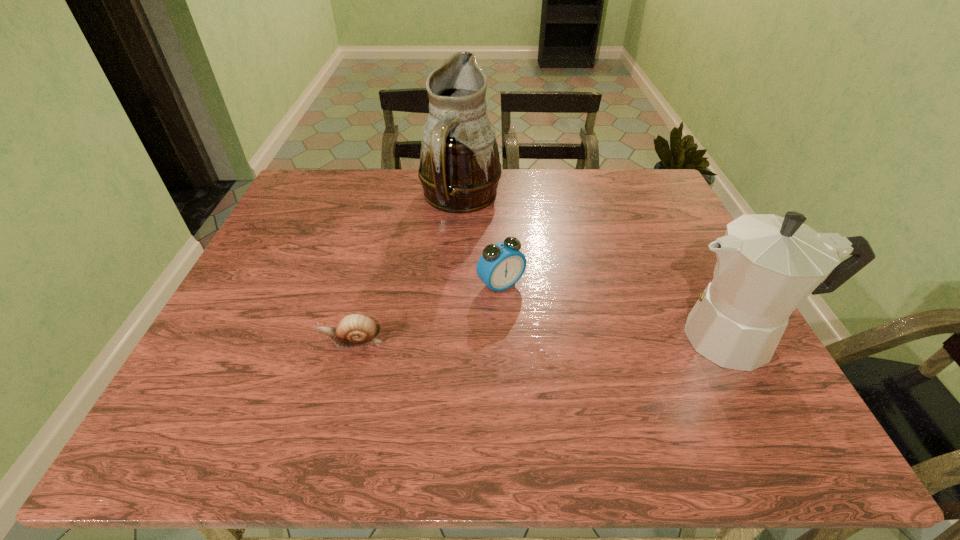
Where is `escargot`? escargot is located at coordinates (354, 330).

In order to click on the leftmost object in this screenshot , I will do `click(354, 330)`.

This screenshot has width=960, height=540. Identify the location of coffeepot. (767, 265).

Find the location of a particular element. the third shortest object is located at coordinates (767, 265).

At what (x,y) coordinates should I click in order to perform the action: click on pitcher. Please return your answer as a coordinate pair (x, y). The width and height of the screenshot is (960, 540). Looking at the image, I should click on (459, 170).

What are the coordinates of `the tallest object` in the screenshot? It's located at [459, 170].

The height and width of the screenshot is (540, 960). In order to click on the second farthest object in this screenshot , I will do `click(501, 265)`.

Find the location of `the second shortest object`. the second shortest object is located at coordinates (501, 265).

Where is `free space located on the front-facing side of the escargot`? Image resolution: width=960 pixels, height=540 pixels. free space located on the front-facing side of the escargot is located at coordinates (207, 341).

I want to click on vacant position located 0.240m on the front-facing side of the escargot, so 212,341.